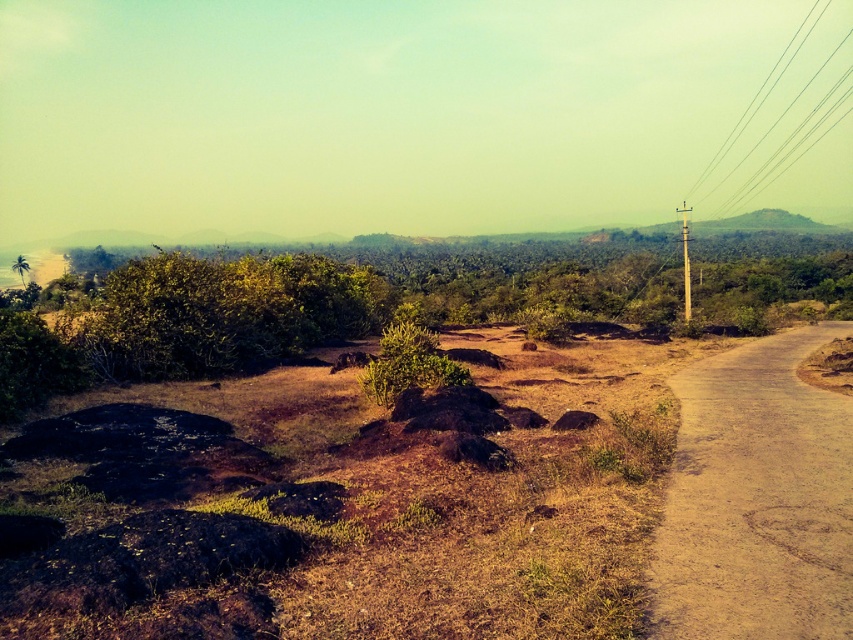
Question: Does brown earthy dirt field at center come behind dirt road at right?

Choices:
 (A) yes
 (B) no

Answer: (B)

Question: Which of the following is the closest to the observer?

Choices:
 (A) dirt road at right
 (B) brown earthy dirt field at center

Answer: (B)

Question: Can you confirm if dirt road at right is positioned above metallic wire at right?

Choices:
 (A) yes
 (B) no

Answer: (B)

Question: Based on their relative distances, which object is farther from the dirt road at right?

Choices:
 (A) brown earthy dirt field at center
 (B) metallic wire at right

Answer: (B)

Question: Can you confirm if brown earthy dirt field at center is bigger than dirt road at right?

Choices:
 (A) yes
 (B) no

Answer: (A)

Question: Which point is closer to the camera taking this photo?

Choices:
 (A) [x=12, y=264]
 (B) [x=531, y=388]
 (C) [x=786, y=563]
 (D) [x=799, y=115]

Answer: (C)